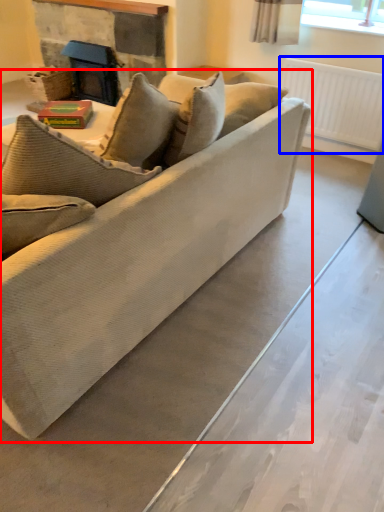
Question: Which of the following is the closest to the observer, studio couch (highlighted by a red box) or radiator (highlighted by a blue box)?

Choices:
 (A) studio couch
 (B) radiator

Answer: (A)